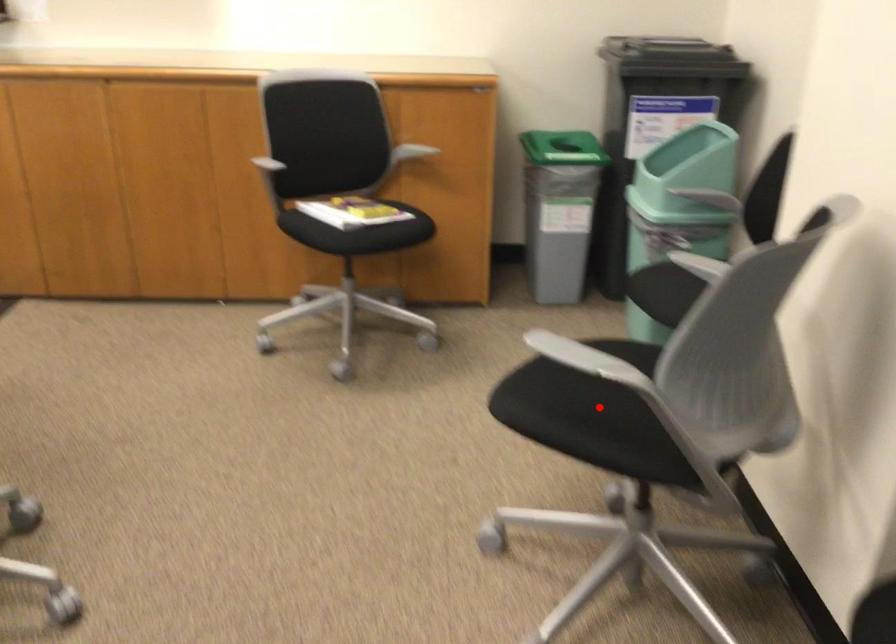
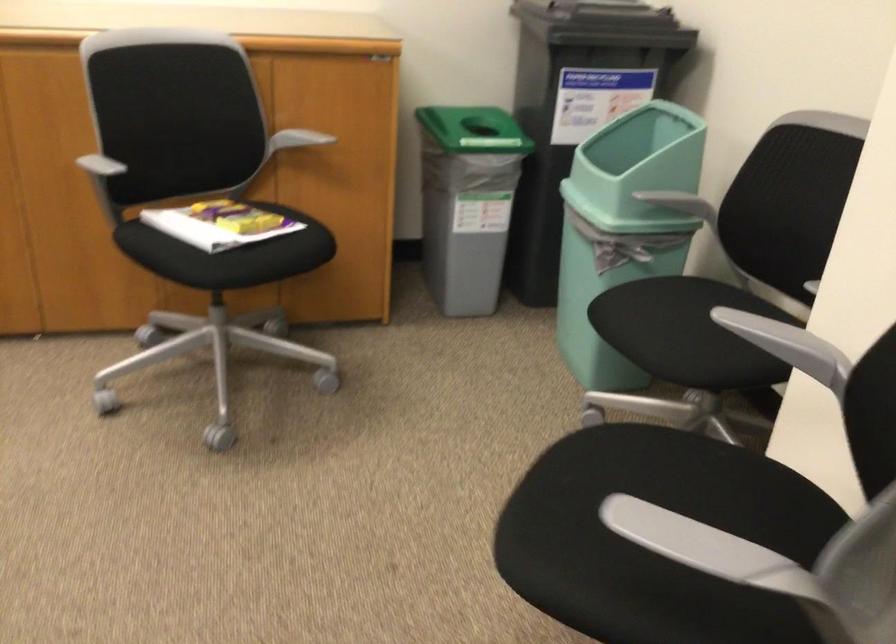
Question: I am providing you with two images of the same scene from different viewpoints. A red point is marked on the first image. At the location where the point appears in image 1, is it still visible in image 2?

Choices:
 (A) Yes
 (B) No

Answer: (B)